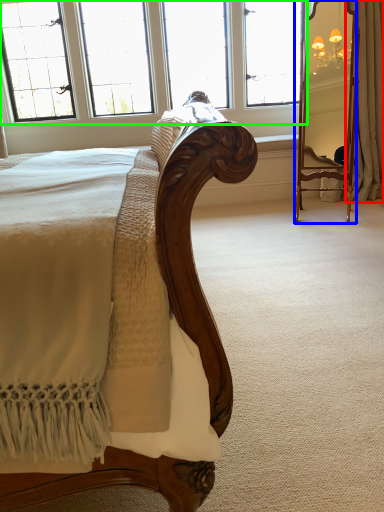
Question: Considering the real-world distances, which object is farthest from curtain (highlighted by a red box)? mirror (highlighted by a blue box) or window (highlighted by a green box)?

Choices:
 (A) mirror
 (B) window

Answer: (B)